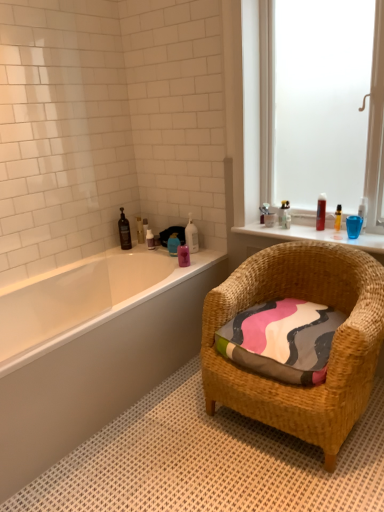
Describe the element at coordinates (150, 239) in the screenshot. Image resolution: width=384 pixels, height=512 pixels. I see `translucent plastic soap dispenser at upper center, acting as the seventh toiletry starting from the right` at that location.

What do you see at coordinates (264, 212) in the screenshot? This screenshot has height=512, width=384. I see `clear plastic bottle at upper right, which is the eighth toiletry in left-to-right order` at bounding box center [264, 212].

The height and width of the screenshot is (512, 384). I want to click on white glossy bathtub at lower left, so click(x=94, y=349).

Measure the distance between point (240, 469) and camera.

6.16 feet.

How much space does translucent plastic bottle at upper right, which is the tenth toiletry in left-to-right order, occupy horizontally?

The width of translucent plastic bottle at upper right, which is the tenth toiletry in left-to-right order, is 2.54 inches.

Identify the location of transparent glass window at upper right. The height and width of the screenshot is (512, 384). (375, 126).

Is shiny brown bottle at left, which ranks as the first toiletry in left-to-right order, turned away from translucent plastic bottle at upper left, the eighth toiletry in the right-to-left sequence?

No.

In the image, is shiny brown bottle at left, marked as the tenth toiletry in a right-to-left arrangement, positioned in front of or behind translucent plastic bottle at upper left, the 3th toiletry viewed from the left?

shiny brown bottle at left, marked as the tenth toiletry in a right-to-left arrangement, is positioned closer to the viewer than translucent plastic bottle at upper left, the 3th toiletry viewed from the left.

Is shiny brown bottle at left, marked as the tenth toiletry in a right-to-left arrangement, not inside translucent plastic bottle at upper left, the 3th toiletry viewed from the left?

Yes.

Considering the sizes of objects shiny brown bottle at left, marked as the tenth toiletry in a right-to-left arrangement, and translucent plastic bottle at upper left, the 3th toiletry viewed from the left, in the image provided, who is bigger, shiny brown bottle at left, marked as the tenth toiletry in a right-to-left arrangement, or translucent plastic bottle at upper left, the 3th toiletry viewed from the left,?

shiny brown bottle at left, marked as the tenth toiletry in a right-to-left arrangement.

Is point (285, 203) less distant than point (183, 265)?

Yes, it is in front of point (183, 265).

From the image's perspective, is clear plastic bottle at upper right, which is the ninth toiletry in left-to-right order, located beneath pink glossy bottle at upper center, positioned as the sixth toiletry in left-to-right order?

No, from the image's perspective, clear plastic bottle at upper right, which is the ninth toiletry in left-to-right order, is not beneath pink glossy bottle at upper center, positioned as the sixth toiletry in left-to-right order.

Based on the photo, based on their sizes in the image, would you say clear plastic bottle at upper right, the second toiletry positioned from the right, is bigger or smaller than pink glossy bottle at upper center, which is the fifth toiletry in right-to-left order?

In the image, clear plastic bottle at upper right, the second toiletry positioned from the right, appears to be smaller than pink glossy bottle at upper center, which is the fifth toiletry in right-to-left order.

Is clear plastic bottle at upper right, the second toiletry positioned from the right, aimed at pink glossy bottle at upper center, positioned as the sixth toiletry in left-to-right order?

No, clear plastic bottle at upper right, the second toiletry positioned from the right, is not facing towards pink glossy bottle at upper center, positioned as the sixth toiletry in left-to-right order.

Is the depth of translucent plastic bottle at upper left, the 3th toiletry viewed from the left, less than that of textured woven pillow at lower right?

No, it is not.

Considering the sizes of translucent plastic bottle at upper left, the eighth toiletry in the right-to-left sequence, and textured woven pillow at lower right in the image, is translucent plastic bottle at upper left, the eighth toiletry in the right-to-left sequence, wider or thinner than textured woven pillow at lower right?

translucent plastic bottle at upper left, the eighth toiletry in the right-to-left sequence, is thinner than textured woven pillow at lower right.

Consider the image. Is textured woven pillow at lower right surrounded by translucent plastic bottle at upper left, the 3th toiletry viewed from the left?

No.

How many degrees apart are the facing directions of translucent plastic bottle at upper left, the 3th toiletry viewed from the left, and textured woven pillow at lower right?

There is a 0.609-degree angle between the facing directions of translucent plastic bottle at upper left, the 3th toiletry viewed from the left, and textured woven pillow at lower right.

Is clear plastic bottle at upper right, the 3th toiletry from the right, surrounded by shiny brown bottle at left, which ranks as the first toiletry in left-to-right order?

That's incorrect, clear plastic bottle at upper right, the 3th toiletry from the right, is not inside shiny brown bottle at left, which ranks as the first toiletry in left-to-right order.

Considering the positions of point (119, 224) and point (264, 208), is point (119, 224) closer or farther from the camera than point (264, 208)?

Point (119, 224).

Considering their positions, is shiny brown bottle at left, marked as the tenth toiletry in a right-to-left arrangement, located in front of or behind clear plastic bottle at upper right, the 3th toiletry from the right?

Visually, shiny brown bottle at left, marked as the tenth toiletry in a right-to-left arrangement, is located behind clear plastic bottle at upper right, the 3th toiletry from the right.

Is textured beige bath mat at lower center facing away from textured woven pillow at lower right?

No.

Could you measure the distance between textured beige bath mat at lower center and textured woven pillow at lower right?

textured beige bath mat at lower center and textured woven pillow at lower right are 19.06 inches apart from each other.

From a real-world perspective, who is located lower, textured beige bath mat at lower center or textured woven pillow at lower right?

In real-world perspective, textured beige bath mat at lower center is lower.

Where is `bath mat beneath the textured woven pillow at lower right (from a real-world perspective)`? The width and height of the screenshot is (384, 512). bath mat beneath the textured woven pillow at lower right (from a real-world perspective) is located at coordinates (209, 462).

Consider the image. Can you tell me how much clear plastic bottle at upper right, which is the eighth toiletry in left-to-right order, and translucent plastic bottle at upper left, the eighth toiletry in the right-to-left sequence, differ in facing direction?

There is a 0.579-degree angle between the facing directions of clear plastic bottle at upper right, which is the eighth toiletry in left-to-right order, and translucent plastic bottle at upper left, the eighth toiletry in the right-to-left sequence.

Is clear plastic bottle at upper right, which is the eighth toiletry in left-to-right order, bigger than translucent plastic bottle at upper left, the 3th toiletry viewed from the left?

Correct, clear plastic bottle at upper right, which is the eighth toiletry in left-to-right order, is larger in size than translucent plastic bottle at upper left, the 3th toiletry viewed from the left.

Between clear plastic bottle at upper right, which is the eighth toiletry in left-to-right order, and translucent plastic bottle at upper left, the eighth toiletry in the right-to-left sequence, which one has larger width?

With larger width is clear plastic bottle at upper right, which is the eighth toiletry in left-to-right order.

Is clear plastic bottle at upper right, which is the eighth toiletry in left-to-right order, beside translucent plastic bottle at upper left, the eighth toiletry in the right-to-left sequence?

There is a gap between clear plastic bottle at upper right, which is the eighth toiletry in left-to-right order, and translucent plastic bottle at upper left, the eighth toiletry in the right-to-left sequence.

Considering the relative sizes of white glossy bathtub at lower left and textured beige bath mat at lower center in the image provided, is white glossy bathtub at lower left thinner than textured beige bath mat at lower center?

Yes, white glossy bathtub at lower left is thinner than textured beige bath mat at lower center.

Visually, is white glossy bathtub at lower left positioned to the left or to the right of textured beige bath mat at lower center?

white glossy bathtub at lower left is positioned on textured beige bath mat at lower center's left side.

Is white glossy bathtub at lower left looking in the opposite direction of textured beige bath mat at lower center?

That's not correct — white glossy bathtub at lower left is not looking away from textured beige bath mat at lower center.

From the image's perspective, relative to textured beige bath mat at lower center, is white glossy bathtub at lower left above or below?

From the image's perspective, white glossy bathtub at lower left appears above textured beige bath mat at lower center.

Which toiletry is the 2nd one when counting from the left side of the translucent plastic bottle at upper left, the 3th toiletry viewed from the left? Please provide its 2D coordinates.

[(124, 231)]

The height and width of the screenshot is (512, 384). I want to click on toiletry that is the 7th one above the pink glossy bottle at upper center, which is the fifth toiletry in right-to-left order (from a real-world perspective), so click(x=284, y=213).

From the image, which object appears to be farther from translucent plastic bottle at upper left, the eighth toiletry in the right-to-left sequence, textured woven pillow at lower right or woven wicker chair at lower right?

woven wicker chair at lower right is positioned further to the anchor translucent plastic bottle at upper left, the eighth toiletry in the right-to-left sequence.

Considering their positions, is translucent glass bottles at upper right positioned further to textured beige bath mat at lower center than shiny brown bottle at left, which ranks as the first toiletry in left-to-right order?

Based on the image, shiny brown bottle at left, which ranks as the first toiletry in left-to-right order, appears to be further to textured beige bath mat at lower center.

Based on their spatial positions, is transparent glass window at upper right or clear plastic bottle at upper right, the 3th toiletry from the right, further from translucent plastic soap dispenser at upper center, acting as the seventh toiletry starting from the right?

transparent glass window at upper right lies further to translucent plastic soap dispenser at upper center, acting as the seventh toiletry starting from the right, than the other object.

From the image, which object appears to be nearer to textured beige bath mat at lower center, shiny brown bottle at left, marked as the tenth toiletry in a right-to-left arrangement, or white glossy bottle at upper center, which appears as the seventh toiletry when viewed from the left?

white glossy bottle at upper center, which appears as the seventh toiletry when viewed from the left, is positioned closer to the anchor textured beige bath mat at lower center.

Estimate the real-world distances between objects in this image. Which object is further from translucent plastic bottle at upper center, the 6th toiletry in the right-to-left sequence, shiny brown bottle at left, marked as the tenth toiletry in a right-to-left arrangement, or translucent glass bottles at upper right?

translucent glass bottles at upper right is positioned further to the anchor translucent plastic bottle at upper center, the 6th toiletry in the right-to-left sequence.

Considering their positions, is woven wicker chair at lower right positioned closer to pink glossy bottle at upper center, which is the fifth toiletry in right-to-left order, than translucent plastic bottle at upper center, acting as the 5th toiletry starting from the left?

translucent plastic bottle at upper center, acting as the 5th toiletry starting from the left.

Looking at the image, which one is located further to shiny brown bottle at left, marked as the tenth toiletry in a right-to-left arrangement, textured woven pillow at lower right or white glossy bottle at upper center, which is the 4th toiletry from right to left?

The object further to shiny brown bottle at left, marked as the tenth toiletry in a right-to-left arrangement, is textured woven pillow at lower right.

Estimate the real-world distances between objects in this image. Which object is closer to transparent glass window at upper right, clear plastic bottle at upper right, which is the ninth toiletry in left-to-right order, or white glossy bathtub at lower left?

clear plastic bottle at upper right, which is the ninth toiletry in left-to-right order, is closer to transparent glass window at upper right.

Where is `bathtub located between textured beige bath mat at lower center and translucent plastic bottle at upper right, placed as the first toiletry when sorted from right to left, in the depth direction`? The width and height of the screenshot is (384, 512). bathtub located between textured beige bath mat at lower center and translucent plastic bottle at upper right, placed as the first toiletry when sorted from right to left, in the depth direction is located at coordinates (94, 349).

In order to click on chair between textured beige bath mat at lower center and translucent plastic bottle at upper right, which is the tenth toiletry in left-to-right order, from front to back in this screenshot , I will do `click(331, 347)`.

This screenshot has height=512, width=384. Find the location of `window sill positioned between woven wicker chair at lower right and shiny brown bottle at left, which ranks as the first toiletry in left-to-right order, from near to far`. window sill positioned between woven wicker chair at lower right and shiny brown bottle at left, which ranks as the first toiletry in left-to-right order, from near to far is located at coordinates (314, 234).

The width and height of the screenshot is (384, 512). Identify the location of window positioned between woven wicker chair at lower right and clear plastic bottle at upper right, the second toiletry positioned from the right, from near to far. (375, 126).